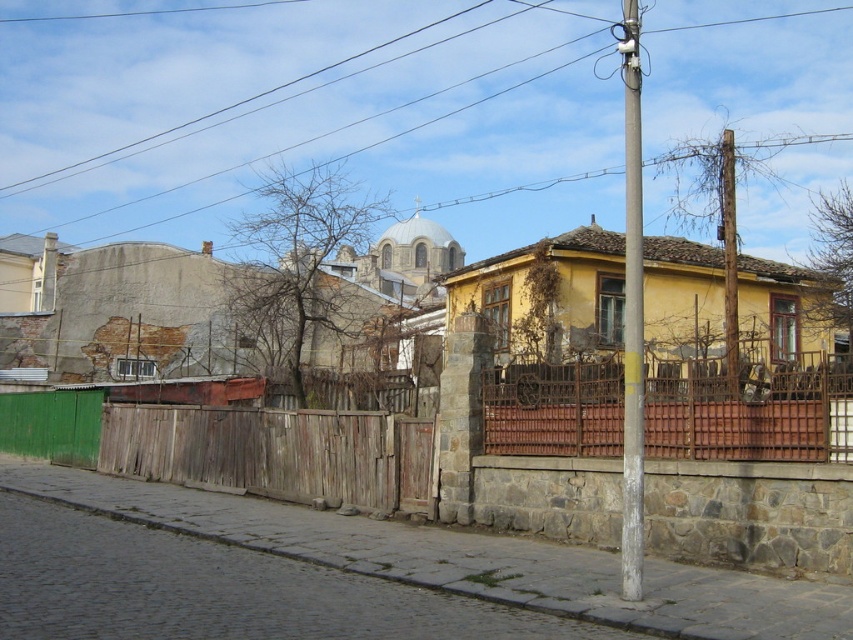
Question: Which object is farther from the camera taking this photo?

Choices:
 (A) weathered wood fence at center
 (B) wooden pole at right
 (C) rusty metal fence at center

Answer: (A)

Question: Which object is farther from the camera taking this photo?

Choices:
 (A) white painted wood pole at right
 (B) rusty metal fence at center

Answer: (B)

Question: Can you confirm if white painted wood pole at right is wider than wooden pole at right?

Choices:
 (A) no
 (B) yes

Answer: (A)

Question: Can you confirm if rusty metal fence at center is positioned above white painted wood pole at right?

Choices:
 (A) yes
 (B) no

Answer: (B)

Question: Can you confirm if white painted wood pole at right is positioned to the right of wooden pole at right?

Choices:
 (A) yes
 (B) no

Answer: (B)

Question: Which point is farther from the camera taking this photo?

Choices:
 (A) (107, 468)
 (B) (631, 493)

Answer: (A)